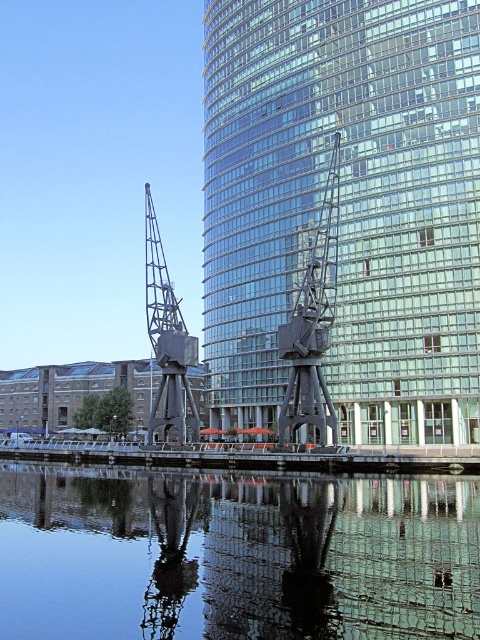
Who is positioned more to the left, smooth concrete dock at center or dark gray metallic sculpture at center?

smooth concrete dock at center is more to the left.

Describe the element at coordinates (249, 456) in the screenshot. I see `smooth concrete dock at center` at that location.

I want to click on smooth concrete dock at center, so click(x=249, y=456).

What do you see at coordinates (235, 556) in the screenshot? I see `transparent glass water at center` at bounding box center [235, 556].

Is transparent glass water at center smaller than metallic industrial crane at center?

Yes.

Is point (392, 634) closer to camera compared to point (180, 324)?

Yes, it is in front of point (180, 324).

Locate an element on the screen. The height and width of the screenshot is (640, 480). transparent glass water at center is located at coordinates (235, 556).

Which is below, dark gray metallic sculpture at center or metallic industrial crane at center?

metallic industrial crane at center is below.

Is dark gray metallic sculpture at center taller than metallic industrial crane at center?

Yes.

The height and width of the screenshot is (640, 480). Describe the element at coordinates (312, 323) in the screenshot. I see `dark gray metallic sculpture at center` at that location.

Identify the location of dark gray metallic sculpture at center. This screenshot has height=640, width=480. (312, 323).